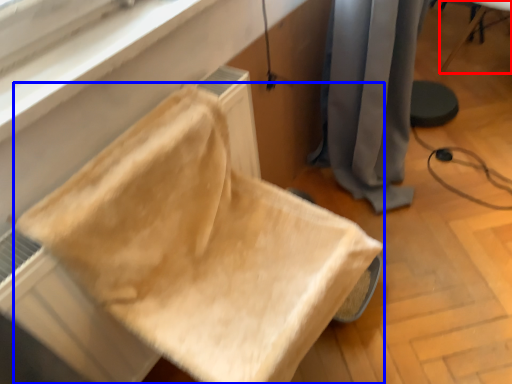
Question: Which point is further to the camera, furniture (highlighted by a red box) or furniture (highlighted by a blue box)?

Choices:
 (A) furniture
 (B) furniture

Answer: (A)